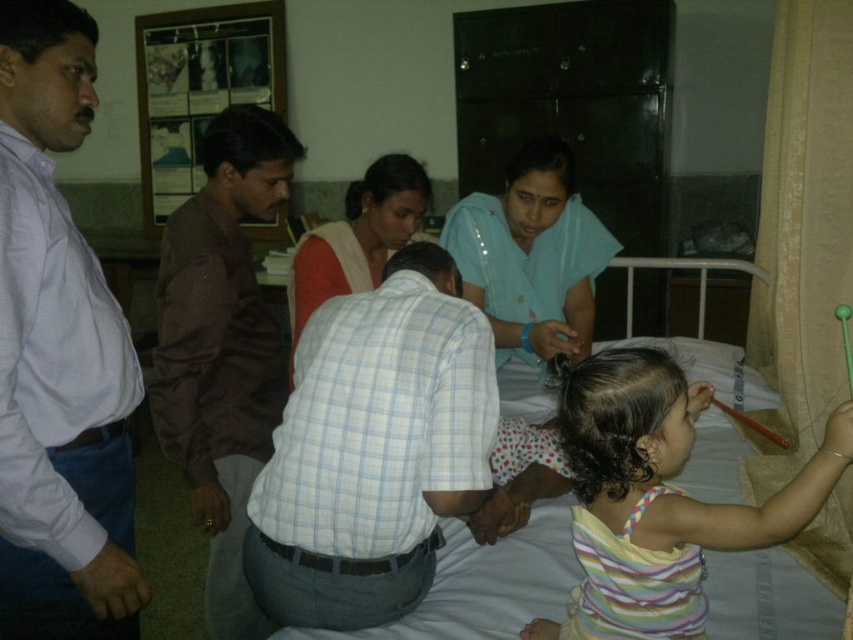
In the hospital room scene, there is a white shirt at left and a white fabric bed at center. Which object is positioned more to the left side of the room?

The white shirt at left is positioned more to the left side of the room than the white fabric bed at center.

You are standing in the hospital room and want to check the vital signs of the child on the bed. The medical device you need is located at point (312,588). Can you reach it without moving your position?

The point (312,588) is 1.29 meters away from you, so you cannot reach it without moving since the distance is too far.